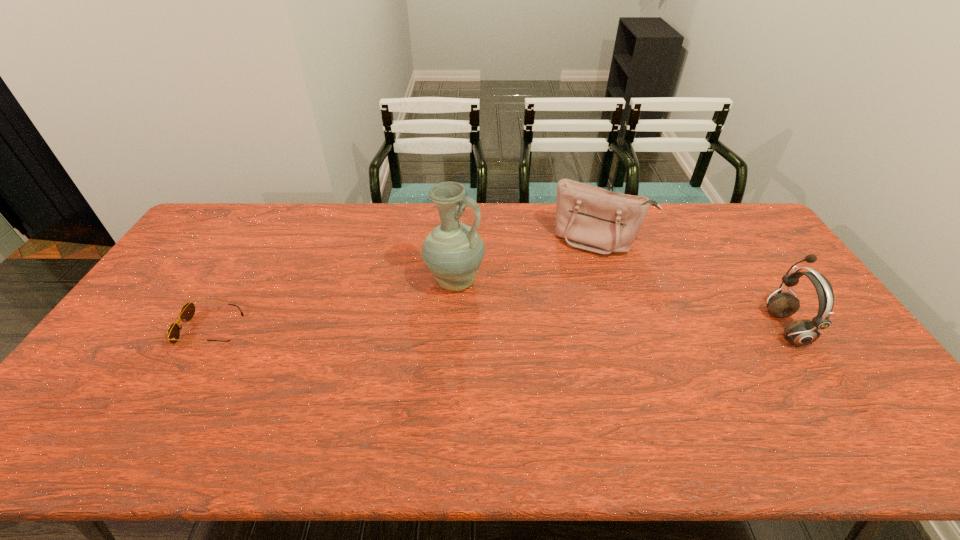
At what (x,y) coordinates should I click in order to perform the action: click on sunglasses. Please return your answer as a coordinate pair (x, y). Looking at the image, I should click on (187, 312).

Where is `the shortest object`? The image size is (960, 540). the shortest object is located at coordinates click(x=187, y=312).

Where is `the rightmost object`? the rightmost object is located at coordinates (803, 332).

Image resolution: width=960 pixels, height=540 pixels. I want to click on pitcher, so click(453, 251).

The height and width of the screenshot is (540, 960). Find the location of `the second object from left to right`. the second object from left to right is located at coordinates (453, 251).

Find the location of `shoulder bag`. shoulder bag is located at coordinates (590, 218).

Find the location of `the second object from right to left`. the second object from right to left is located at coordinates (590, 218).

Where is `free location located 0.080m on the lenses of the leftmost object`? The width and height of the screenshot is (960, 540). free location located 0.080m on the lenses of the leftmost object is located at coordinates (155, 329).

Identify the location of vacant space located on the lenses of the leftmost object. The image size is (960, 540). (165, 329).

Identify the location of free space located 0.390m on the ear pads of the rightmost object. (631, 327).